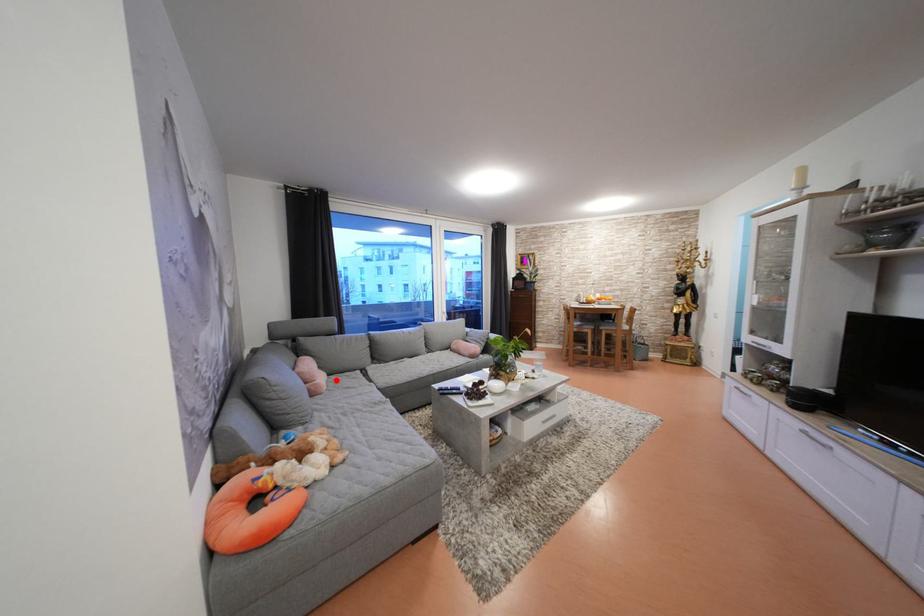
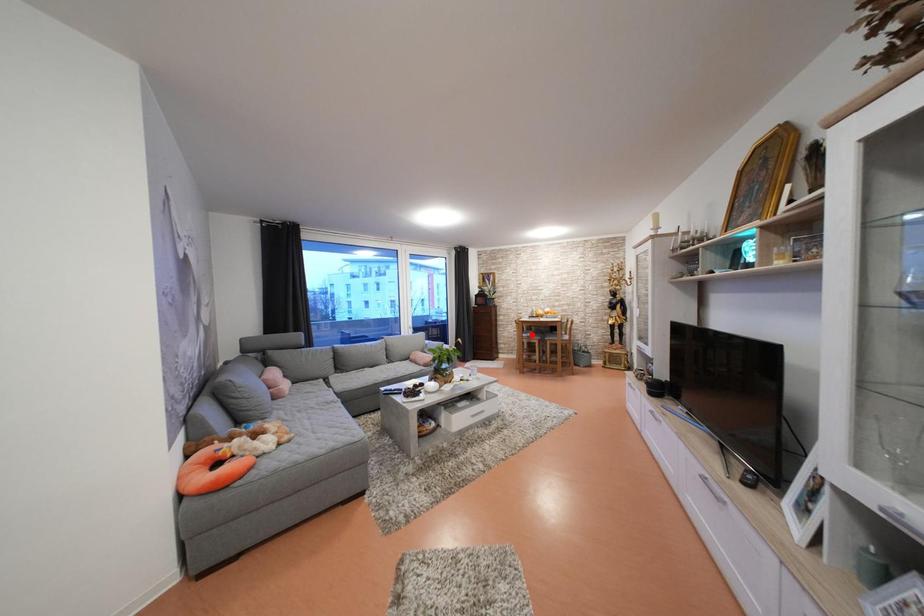
I am providing you with two images of the same scene from different viewpoints. A red point is marked on the first image and another point is marked on the second image. Does the point marked in image1 correspond to the same location as the one in image2?

No